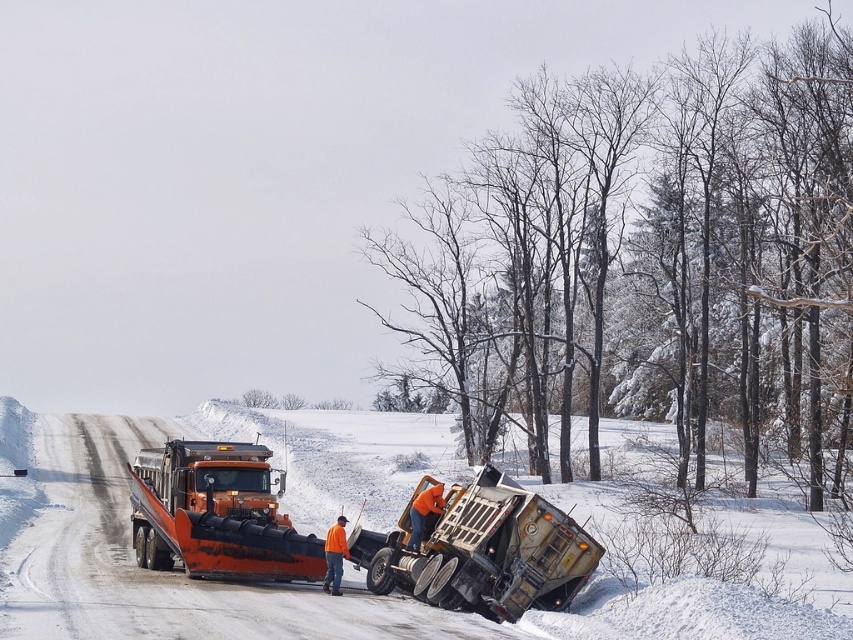
Does white powdery snow at center appear on the right side of orange metallic snowplow at lower center?

No, white powdery snow at center is not to the right of orange metallic snowplow at lower center.

Is point (90, 534) more distant than point (421, 564)?

Yes.

Where is `white powdery snow at center`? white powdery snow at center is located at coordinates (300, 531).

Does white powdery snow at center have a larger size compared to orange matte snowplow at left?

Correct, white powdery snow at center is larger in size than orange matte snowplow at left.

Can you confirm if white powdery snow at center is thinner than orange matte snowplow at left?

In fact, white powdery snow at center might be wider than orange matte snowplow at left.

Find the location of a particular element. white powdery snow at center is located at coordinates pyautogui.click(x=300, y=531).

This screenshot has width=853, height=640. I want to click on white powdery snow at center, so click(x=300, y=531).

Measure the distance from orange metallic snowplow at lower center to orange matte snowplow at left.

A distance of 8.30 meters exists between orange metallic snowplow at lower center and orange matte snowplow at left.

Can you confirm if orange metallic snowplow at lower center is wider than orange matte snowplow at left?

No, orange metallic snowplow at lower center is not wider than orange matte snowplow at left.

The width and height of the screenshot is (853, 640). I want to click on orange metallic snowplow at lower center, so click(x=482, y=550).

The height and width of the screenshot is (640, 853). In order to click on orange metallic snowplow at lower center in this screenshot , I will do `click(482, 550)`.